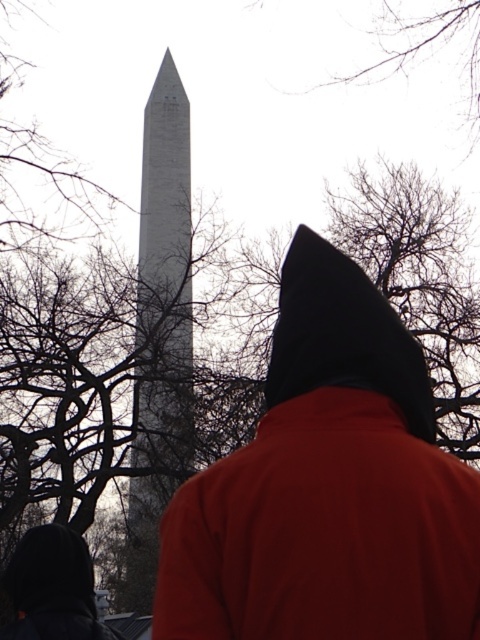
You are standing at the base of the Washington Monument and see the point marked at coordinate (327, 486). What object is located at that position?

The point at coordinate (327, 486) marks the matte black hood at center.

You are standing at the camera position and want to locate the matte black hood at center. What are its coordinates?

The coordinates of the matte black hood at center are at point (327, 486).